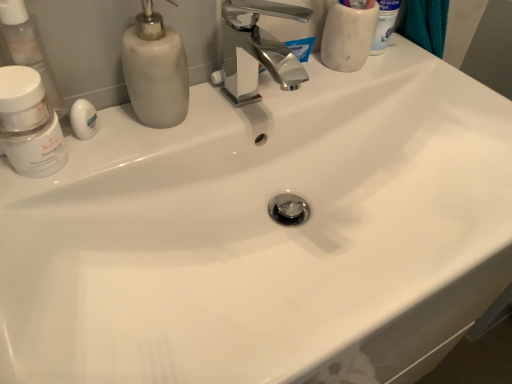
Question: From the image's perspective, does transparent plastic container at left, acting as the second toiletry starting from the top, appear lower than white matte jar at left?

Choices:
 (A) no
 (B) yes

Answer: (A)

Question: Considering the relative positions of transparent plastic container at left, the first toiletry from the front, and white matte jar at left in the image provided, is transparent plastic container at left, the first toiletry from the front, to the left of white matte jar at left from the viewer's perspective?

Choices:
 (A) yes
 (B) no

Answer: (A)

Question: Considering the relative sizes of transparent plastic container at left, acting as the second toiletry starting from the top, and white matte jar at left in the image provided, is transparent plastic container at left, acting as the second toiletry starting from the top, thinner than white matte jar at left?

Choices:
 (A) yes
 (B) no

Answer: (A)

Question: Is transparent plastic container at left, acting as the 1th toiletry starting from the left, positioned with its back to white matte jar at left?

Choices:
 (A) yes
 (B) no

Answer: (B)

Question: Is transparent plastic container at left, acting as the second toiletry starting from the top, oriented towards white matte jar at left?

Choices:
 (A) yes
 (B) no

Answer: (A)

Question: Is transparent plastic container at left, which is the 1th toiletry from bottom to top, bigger than white matte jar at left?

Choices:
 (A) no
 (B) yes

Answer: (A)

Question: Can you confirm if matte white soap dispenser at upper left is smaller than white marble cup at upper right, which is the first toiletry in back-to-front order?

Choices:
 (A) no
 (B) yes

Answer: (B)

Question: Is matte white soap dispenser at upper left located outside white marble cup at upper right, the 1th toiletry positioned from the top?

Choices:
 (A) yes
 (B) no

Answer: (A)

Question: Would you say matte white soap dispenser at upper left is a long distance from white marble cup at upper right, placed as the 1th toiletry when sorted from right to left?

Choices:
 (A) no
 (B) yes

Answer: (A)

Question: Is matte white soap dispenser at upper left at the right side of white marble cup at upper right, the 2th toiletry from the bottom?

Choices:
 (A) no
 (B) yes

Answer: (A)

Question: Considering the relative positions of matte white soap dispenser at upper left and white marble cup at upper right, the 1th toiletry positioned from the top, in the image provided, is matte white soap dispenser at upper left to the left of white marble cup at upper right, the 1th toiletry positioned from the top, from the viewer's perspective?

Choices:
 (A) no
 (B) yes

Answer: (B)

Question: Is matte white soap dispenser at upper left taller than white marble cup at upper right, acting as the 2th toiletry starting from the left?

Choices:
 (A) no
 (B) yes

Answer: (A)

Question: Considering the relative positions of white matte jar at left and white matte soap at left in the image provided, is white matte jar at left to the right of white matte soap at left from the viewer's perspective?

Choices:
 (A) no
 (B) yes

Answer: (A)